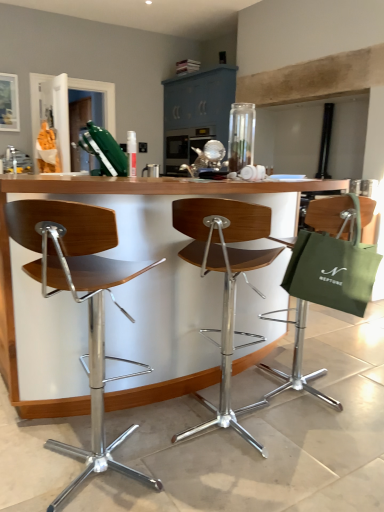
You are a GUI agent. You are given a task and a screenshot of the screen. Output one action in this format:
    pyautogui.click(x=<x>, y=<y>)
    Task: Click on the unoccupied area in front of green fabric bag at right, the 3th chair positioned from the left
    
    Given the screenshot: What is the action you would take?
    pyautogui.click(x=327, y=438)